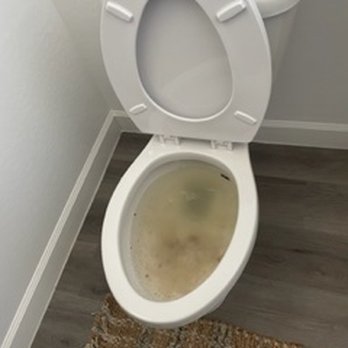
Where is `dirty toilet water`? dirty toilet water is located at coordinates (192, 244).